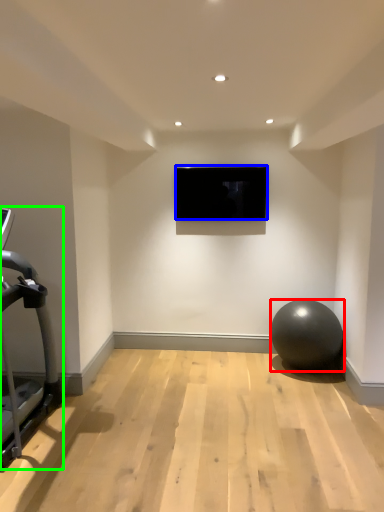
Question: Based on their relative distances, which object is nearer to ball (highlighted by a red box)? Choose from television (highlighted by a blue box) and treadmill (highlighted by a green box).

Choices:
 (A) television
 (B) treadmill

Answer: (A)